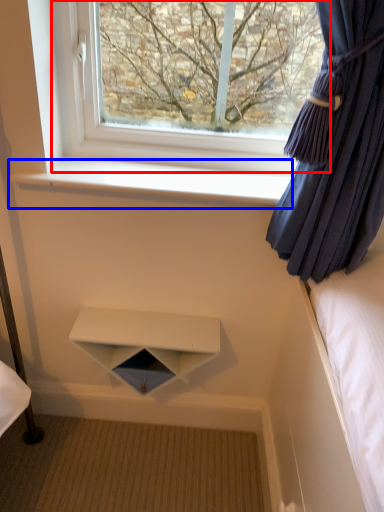
Question: Among these objects, which one is nearest to the camera, window (highlighted by a red box) or window sill (highlighted by a blue box)?

Choices:
 (A) window
 (B) window sill

Answer: (A)